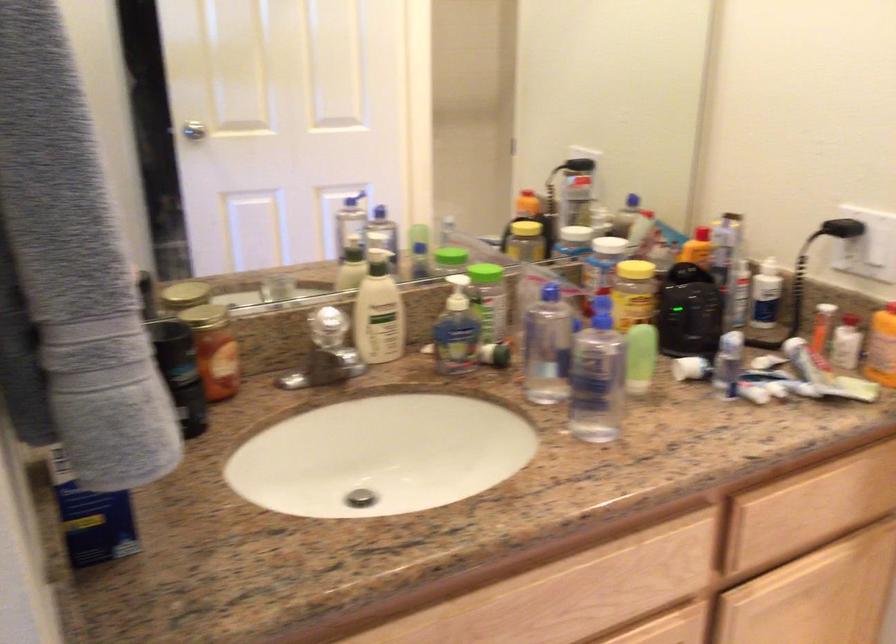
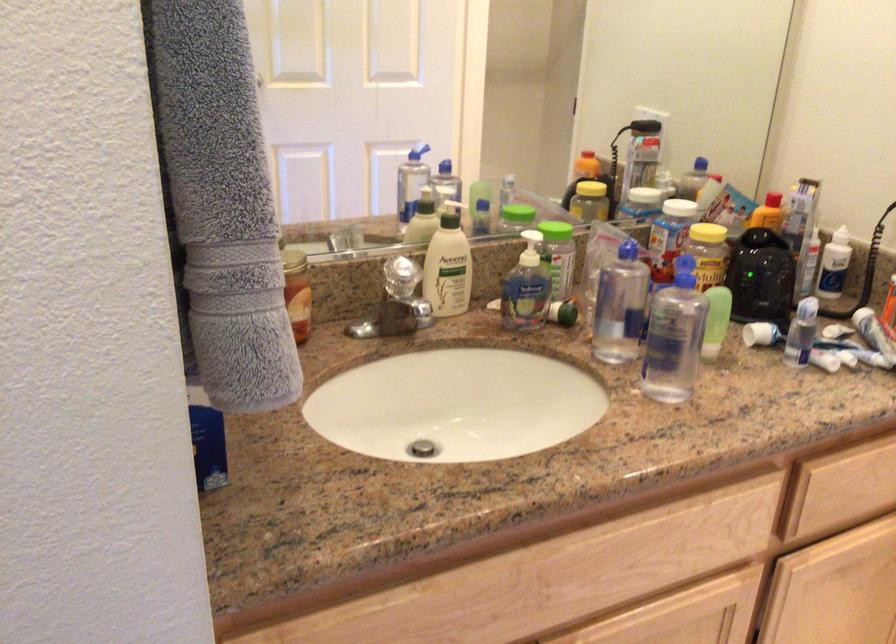
Locate, in the second image, the point that corresponds to point 376,314 in the first image.

(448, 265)